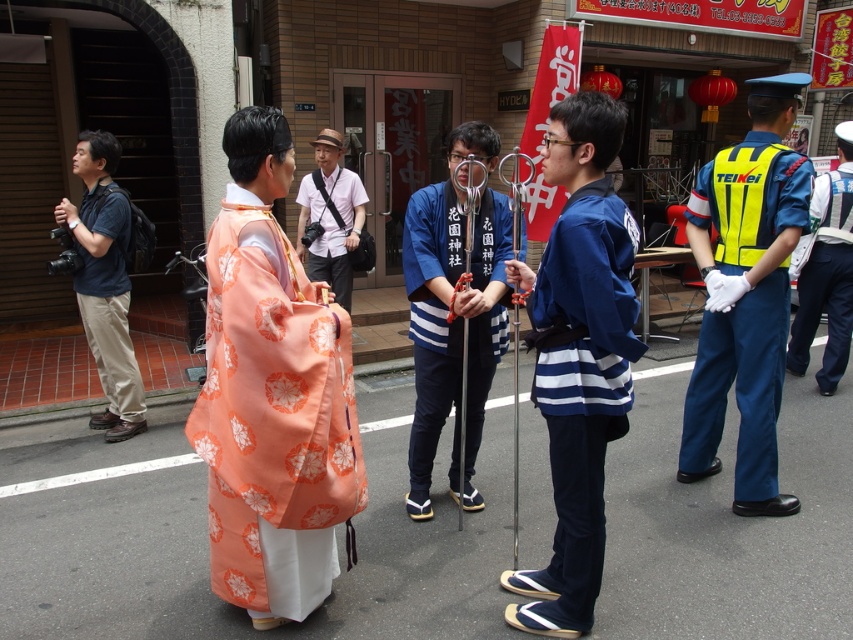
Looking at this image, who is more forward, (x=733, y=294) or (x=341, y=243)?

Point (x=733, y=294) is in front.

Does high-visibility reflective vest at right have a lesser height compared to light brown leather hat at center?

No.

Who is more distant from viewer, (740,285) or (312,202)?

Positioned behind is point (312,202).

Identify the location of high-visibility reflective vest at right. This screenshot has height=640, width=853. (746, 296).

Who is more distant from viewer, [618,419] or [474,321]?

Point [474,321]

Where is `blue fabric kimono at center`? Image resolution: width=853 pixels, height=640 pixels. blue fabric kimono at center is located at coordinates (578, 356).

Does point (590, 424) come closer to viewer compared to point (444, 390)?

That is True.

Locate an element on the screen. blue fabric kimono at center is located at coordinates (578, 356).

Is point (796, 509) in front of point (799, 285)?

That is True.

Does high-visibility reflective vest at right have a lesser width compared to yellow reflective vest at right?

Yes, high-visibility reflective vest at right is thinner than yellow reflective vest at right.

Is point (735, 252) farther from camera compared to point (840, 184)?

No, it is in front of (840, 184).

Find the location of a particular element. The image size is (853, 640). high-visibility reflective vest at right is located at coordinates (746, 296).